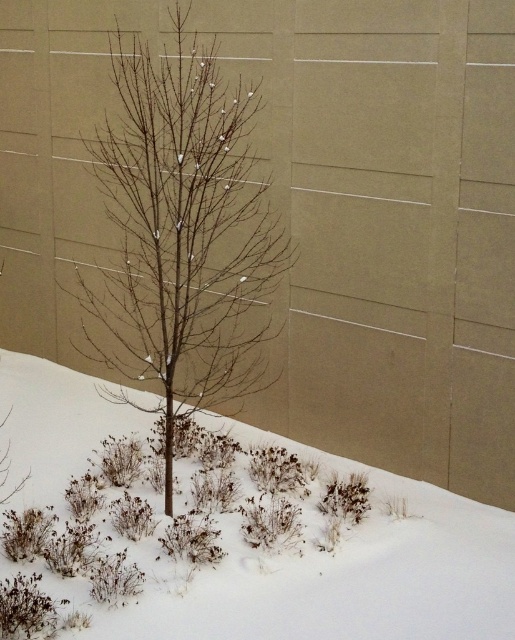
Is white fluffy snow at center below bare branches at center?

Indeed, white fluffy snow at center is positioned under bare branches at center.

Measure the distance between point (412, 504) and camera.

Point (412, 504) and camera are 5.18 meters apart from each other.

Which is behind, point (58, 442) or point (262, 300)?

The point (58, 442) is more distant.

Image resolution: width=515 pixels, height=640 pixels. In order to click on white fluffy snow at center in this screenshot , I will do `click(260, 545)`.